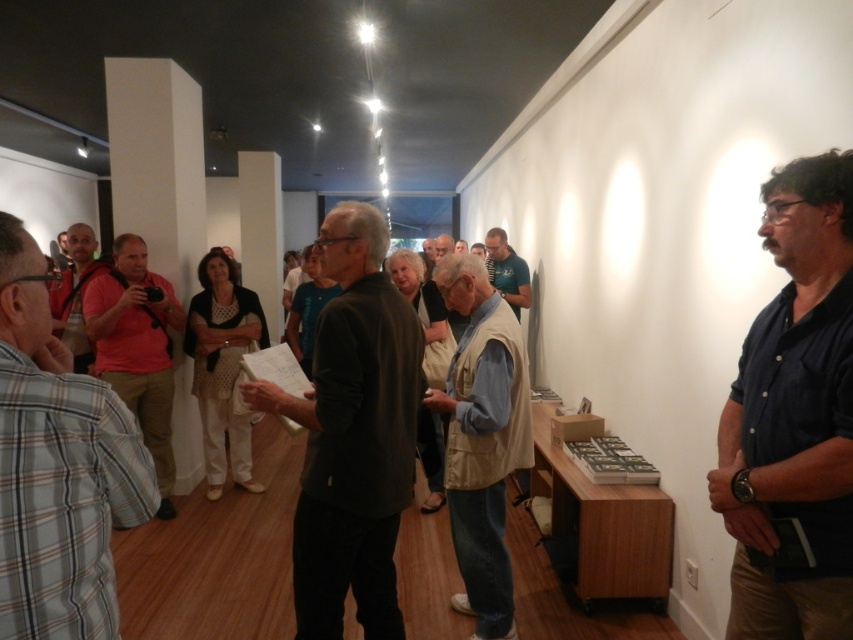
Question: Is dark brown sweater at center bigger than matte red shirt at left?

Choices:
 (A) no
 (B) yes

Answer: (A)

Question: Which object is farther from the camera taking this photo?

Choices:
 (A) dark brown sweater at center
 (B) dark blue shirt at right
 (C) beige fabric vest at center

Answer: (C)

Question: Which object is farther from the camera taking this photo?

Choices:
 (A) blue fabric shirt at center
 (B) light brown leather jacket at center
 (C) beige fabric vest at center

Answer: (B)

Question: Can you confirm if beige fabric vest at center is thinner than blue fabric shirt at center?

Choices:
 (A) yes
 (B) no

Answer: (B)

Question: Is dark blue shirt at right bigger than blue fabric shirt at center?

Choices:
 (A) yes
 (B) no

Answer: (B)

Question: Which of the following is the farthest from the observer?

Choices:
 (A) (61, 579)
 (B) (440, 244)

Answer: (B)